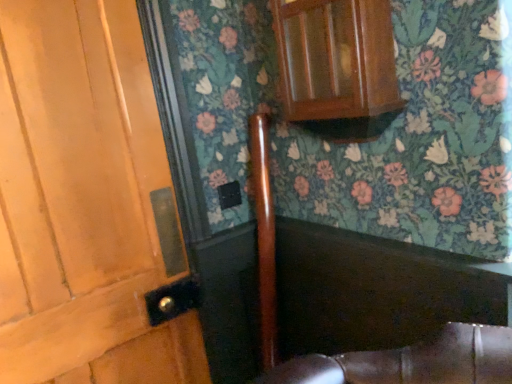
Image resolution: width=512 pixels, height=384 pixels. Describe the element at coordinates (85, 203) in the screenshot. I see `matte wood door at left` at that location.

In order to face matte wood door at left, should I rotate leftwards or rightwards?

Rotate your view left by about 21.012°.

The image size is (512, 384). Identify the location of matte wood door at left. (85, 203).

Locate an element on the screen. matte wood door at left is located at coordinates (85, 203).